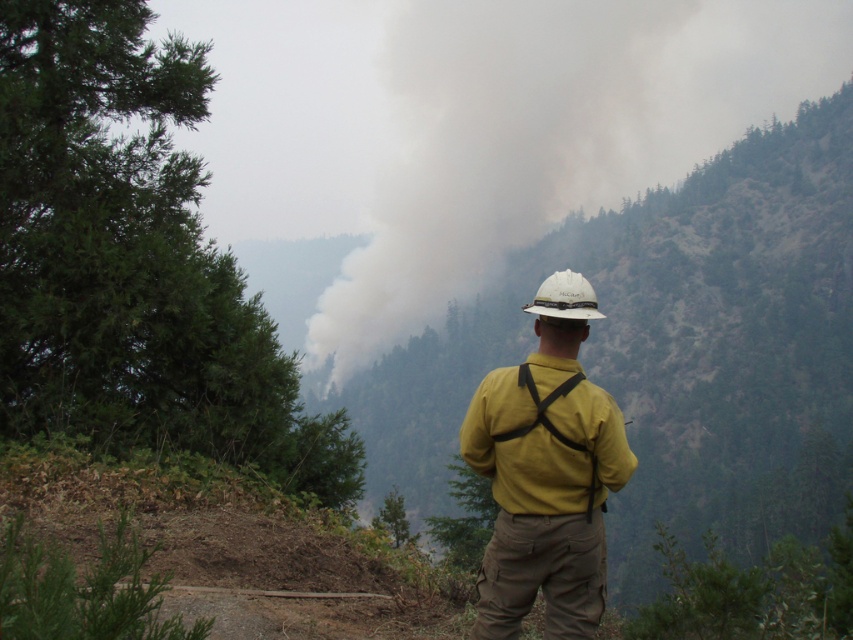
In the scene shown: Can you confirm if smoke/dense at center is positioned to the left of white matte hard hat at center?

No, smoke/dense at center is not to the left of white matte hard hat at center.

Is smoke/dense at center positioned at the back of white matte hard hat at center?

Yes, it is.

Find the location of a particular element. This screenshot has width=853, height=640. smoke/dense at center is located at coordinates (492, 148).

You are a GUI agent. You are given a task and a screenshot of the screen. Output one action in this format:
    pyautogui.click(x=<x>, y=<y>)
    Task: Click on the smoke/dense at center
    The image size is (853, 640).
    Given the screenshot: What is the action you would take?
    pyautogui.click(x=492, y=148)

Who is more distant from viewer, (509,390) or (584,314)?

The point (509,390) is more distant.

Locate an element on the screen. The width and height of the screenshot is (853, 640). yellow fire-resistant shirt at center is located at coordinates (546, 474).

Locate an element on the screen. yellow fire-resistant shirt at center is located at coordinates (546, 474).

Does smoke/dense at center appear under yellow matte jacket at center?

Incorrect, smoke/dense at center is not positioned below yellow matte jacket at center.

How far apart are smoke/dense at center and yellow matte jacket at center?

smoke/dense at center is 199.54 meters from yellow matte jacket at center.

Where is `smoke/dense at center`? Image resolution: width=853 pixels, height=640 pixels. smoke/dense at center is located at coordinates (492, 148).